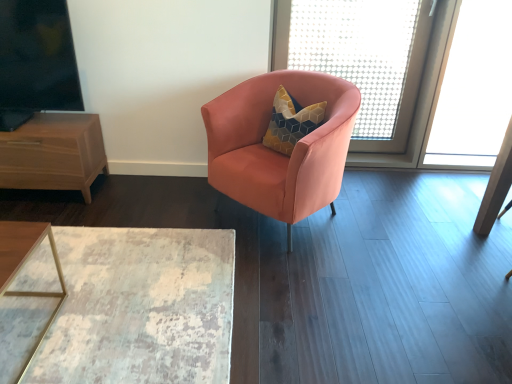
Question: Considering the relative positions of satin peach armchair at center and brown wood nightstand at left in the image provided, is satin peach armchair at center to the left of brown wood nightstand at left from the viewer's perspective?

Choices:
 (A) no
 (B) yes

Answer: (A)

Question: Is brown wood nightstand at left inside satin peach armchair at center?

Choices:
 (A) yes
 (B) no

Answer: (B)

Question: Considering the relative sizes of satin peach armchair at center and brown wood nightstand at left in the image provided, is satin peach armchair at center shorter than brown wood nightstand at left?

Choices:
 (A) no
 (B) yes

Answer: (A)

Question: Is satin peach armchair at center placed right next to brown wood nightstand at left?

Choices:
 (A) yes
 (B) no

Answer: (B)

Question: Would you say satin peach armchair at center is outside brown wood nightstand at left?

Choices:
 (A) yes
 (B) no

Answer: (A)

Question: From a real-world perspective, is satin peach armchair at center on top of brown wood nightstand at left?

Choices:
 (A) no
 (B) yes

Answer: (B)

Question: Could distressed wood table at lower left be considered to be inside translucent mesh screen at upper right, the 2th window screen positioned from the left?

Choices:
 (A) yes
 (B) no

Answer: (B)

Question: Considering the relative sizes of translucent mesh screen at upper right, which ranks as the first window screen in back-to-front order, and distressed wood table at lower left in the image provided, is translucent mesh screen at upper right, which ranks as the first window screen in back-to-front order, wider than distressed wood table at lower left?

Choices:
 (A) no
 (B) yes

Answer: (A)

Question: Is translucent mesh screen at upper right, which ranks as the first window screen in back-to-front order, to the left of distressed wood table at lower left from the viewer's perspective?

Choices:
 (A) no
 (B) yes

Answer: (A)

Question: Considering the relative sizes of translucent mesh screen at upper right, which ranks as the first window screen in back-to-front order, and distressed wood table at lower left in the image provided, is translucent mesh screen at upper right, which ranks as the first window screen in back-to-front order, shorter than distressed wood table at lower left?

Choices:
 (A) no
 (B) yes

Answer: (A)

Question: Does translucent mesh screen at upper right, which is counted as the 2th window screen, starting from the front, turn towards distressed wood table at lower left?

Choices:
 (A) yes
 (B) no

Answer: (B)

Question: Can you confirm if translucent mesh screen at upper right, the 2th window screen positioned from the left, is thinner than distressed wood table at lower left?

Choices:
 (A) yes
 (B) no

Answer: (A)

Question: Is translucent mesh screen at upper right, the 2th window screen positioned from the left, directly adjacent to black glass window screen at upper left, arranged as the 1th window screen when viewed from the front?

Choices:
 (A) no
 (B) yes

Answer: (A)